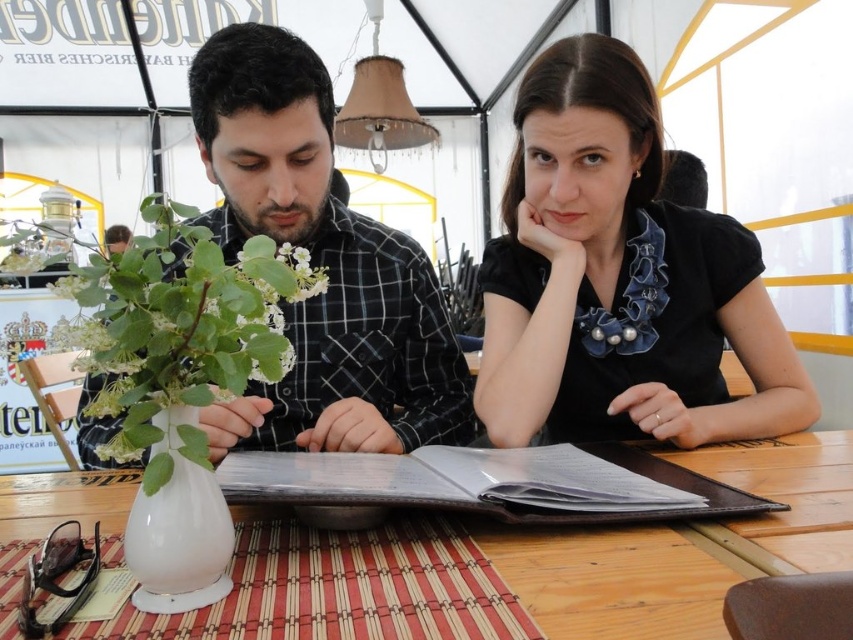
Question: Which is farther from the black satin blouse at center?

Choices:
 (A) white glossy vase at lower left
 (B) white matte flower at center

Answer: (A)

Question: Is black satin blouse at center positioned in front of white glossy vase at lower left?

Choices:
 (A) yes
 (B) no

Answer: (B)

Question: Where is black satin blouse at center located in relation to white matte flower at center in the image?

Choices:
 (A) left
 (B) right

Answer: (B)

Question: Which point appears farthest from the camera in this image?

Choices:
 (A) (563, 577)
 (B) (225, 372)

Answer: (A)

Question: Which of the following is the farthest from the observer?

Choices:
 (A) black satin blouse at center
 (B) checkered fabric shirt at center
 (C) white matte flower at center
 (D) wooden table at center

Answer: (A)

Question: Can you confirm if checkered fabric shirt at center is positioned below white matte flower at center?

Choices:
 (A) yes
 (B) no

Answer: (B)